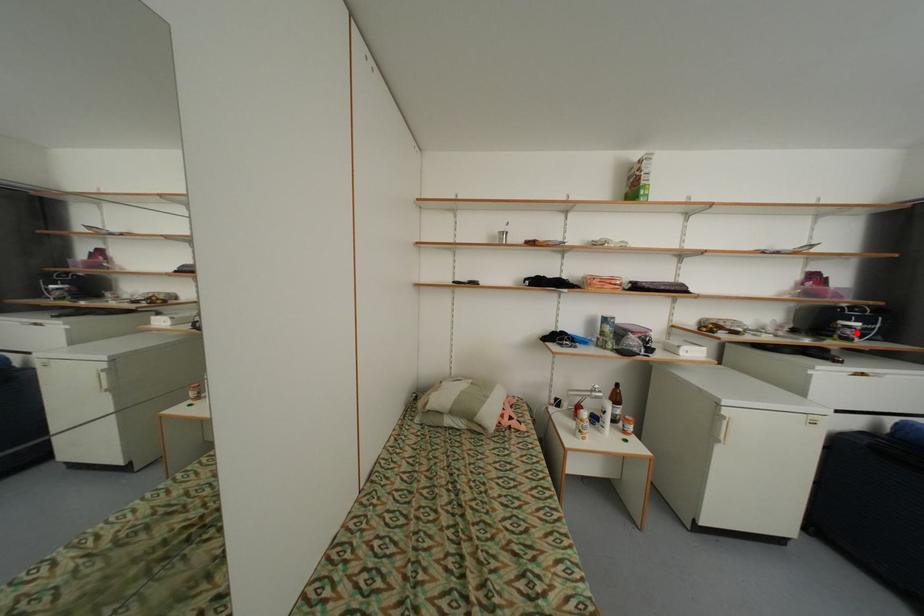
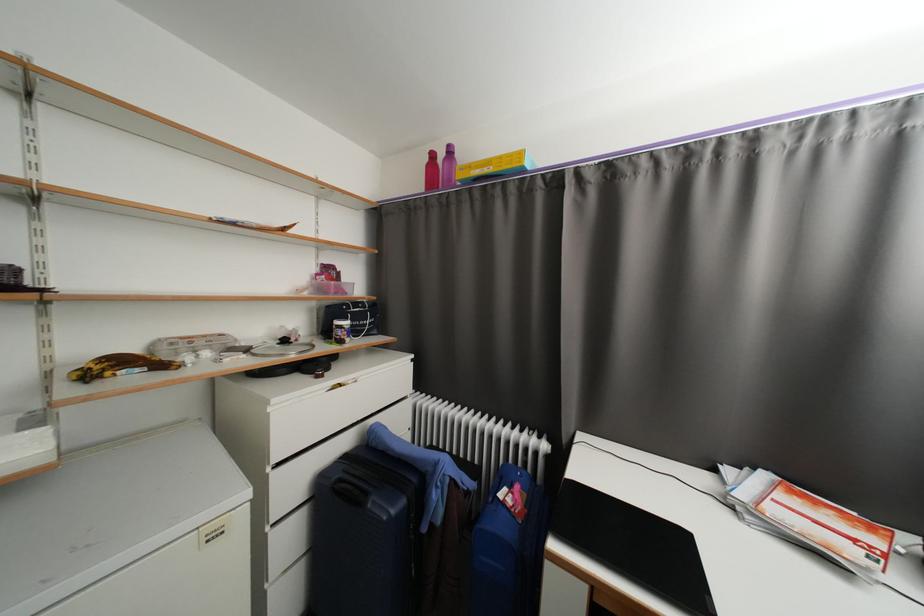
Question: I am providing you with two images of the same scene from different viewpoints. In image1, a red point is highlighted. Considering the same 3D point in image2, which of the following is correct?

Choices:
 (A) It is closer
 (B) It is farther

Answer: (B)